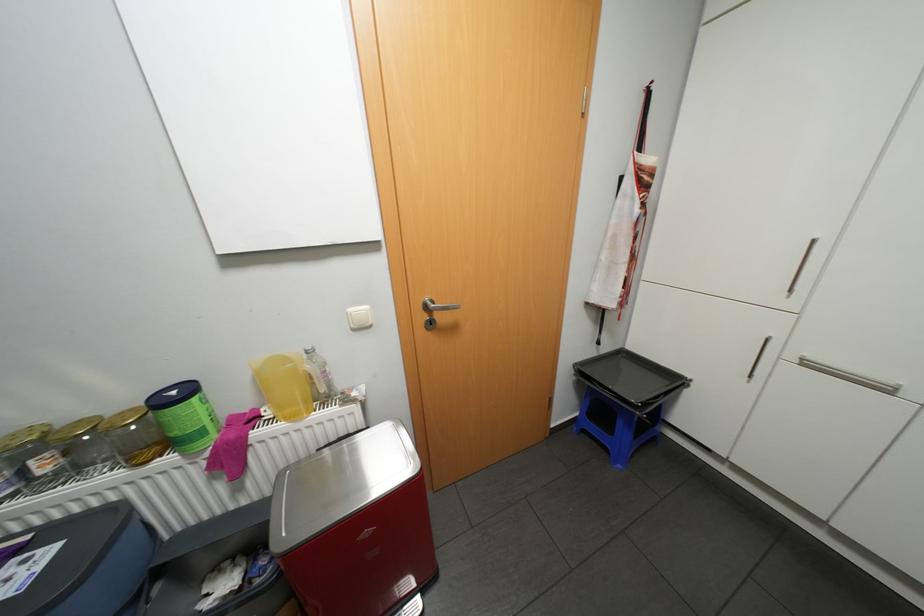
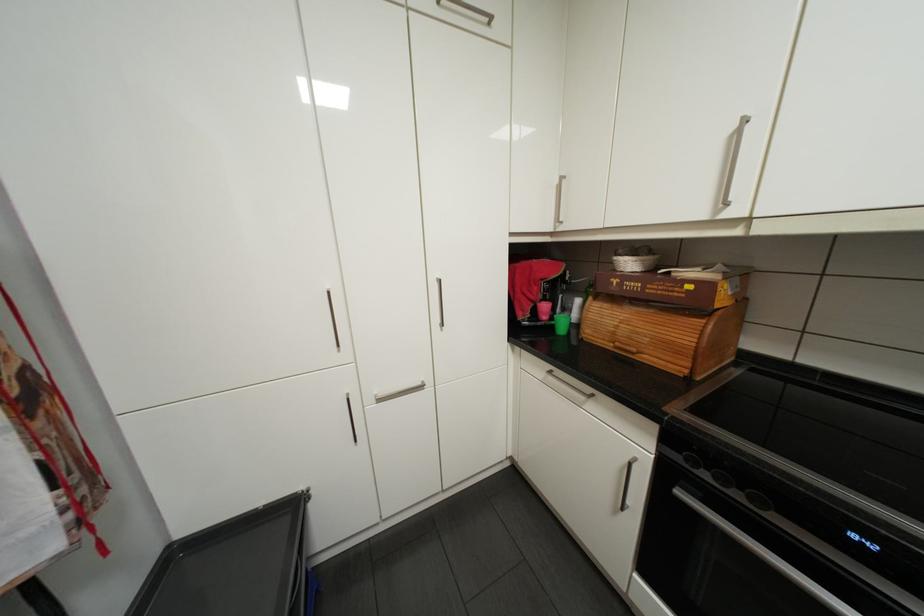
Question: The camera is either moving clockwise (left) or counter-clockwise (right) around the object. The first image is from the beginning of the video and the second image is from the end. Is the camera moving left or right when shooting the video?

Choices:
 (A) Left
 (B) Right

Answer: (A)